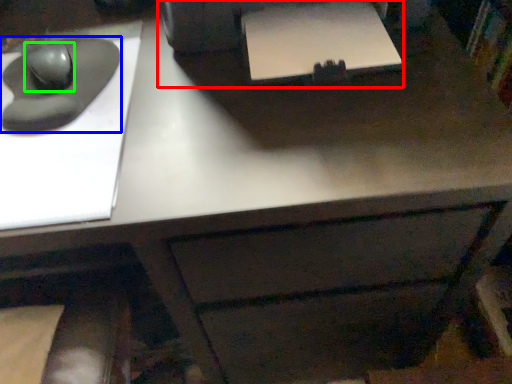
Question: Which object is positioned closest to printer (highlighted by a red box)? Select from mouse (highlighted by a blue box) and mouse (highlighted by a green box).

Choices:
 (A) mouse
 (B) mouse

Answer: (A)